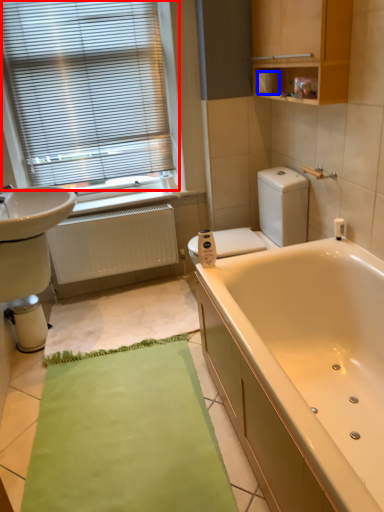
Question: Which of the following is the closest to the observer, window blind (highlighted by a red box) or toilet paper (highlighted by a blue box)?

Choices:
 (A) window blind
 (B) toilet paper

Answer: (A)